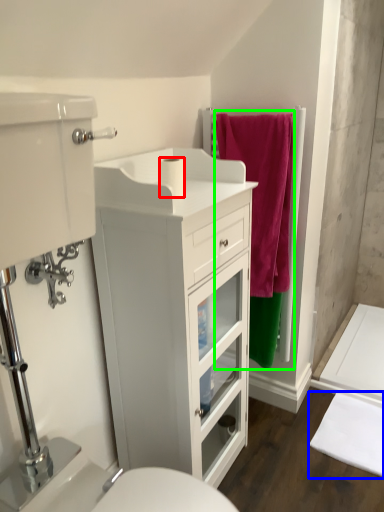
Question: Based on their relative distances, which object is farther from toilet paper (highlighted by a red box)? Choose from bath mat (highlighted by a blue box) and bath towel (highlighted by a green box).

Choices:
 (A) bath mat
 (B) bath towel

Answer: (A)